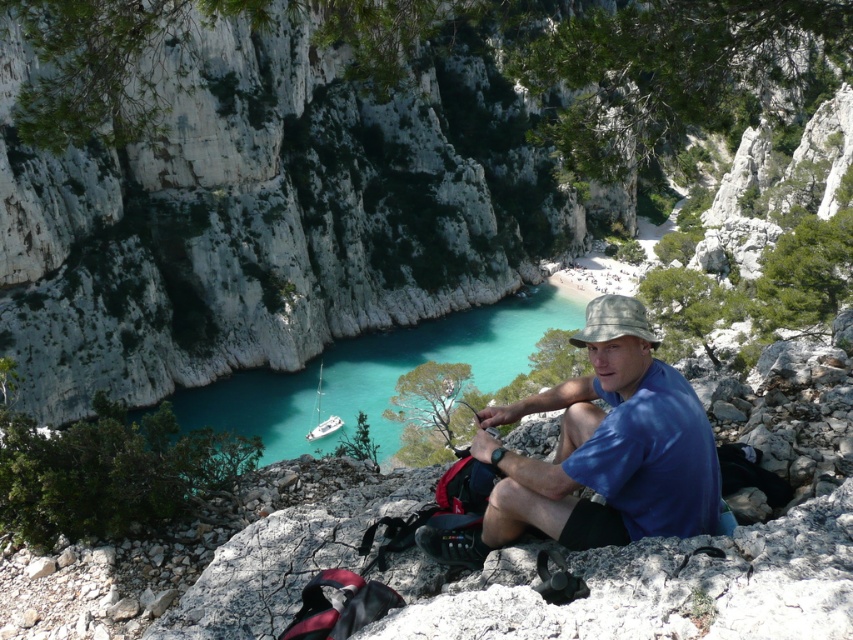
Is blue cotton shirt at center to the left of camouflage fabric baseball hat at center from the viewer's perspective?

Indeed, blue cotton shirt at center is positioned on the left side of camouflage fabric baseball hat at center.

Is the position of blue cotton shirt at center less distant than that of camouflage fabric baseball hat at center?

Yes, it is.

The height and width of the screenshot is (640, 853). What are the coordinates of `blue cotton shirt at center` in the screenshot? It's located at (604, 449).